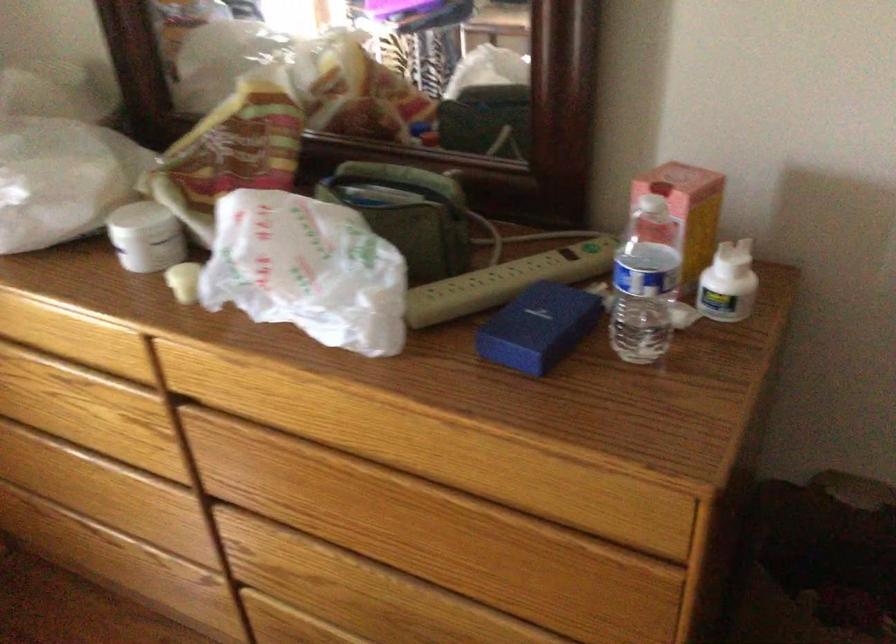
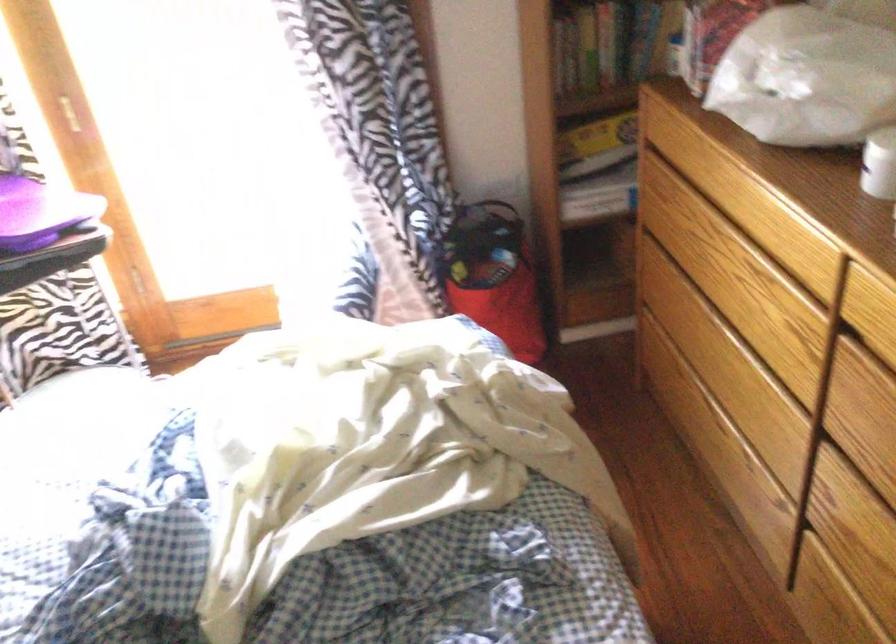
Find the pixel in the second image that matches [73,478] in the first image.

(719, 355)